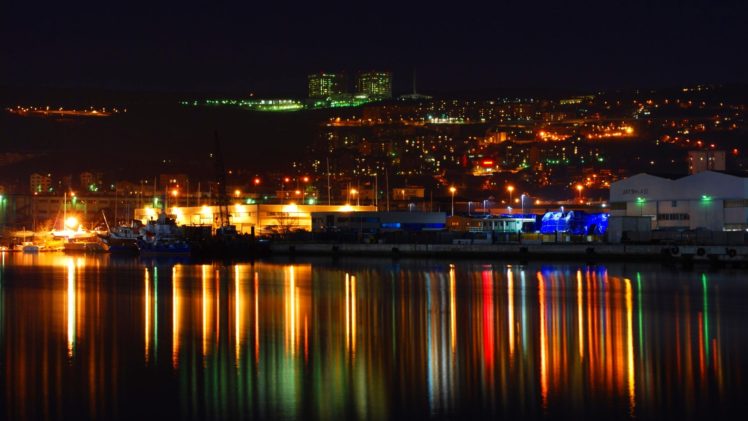
The image size is (748, 421). I want to click on yellow light, so point(511,185).